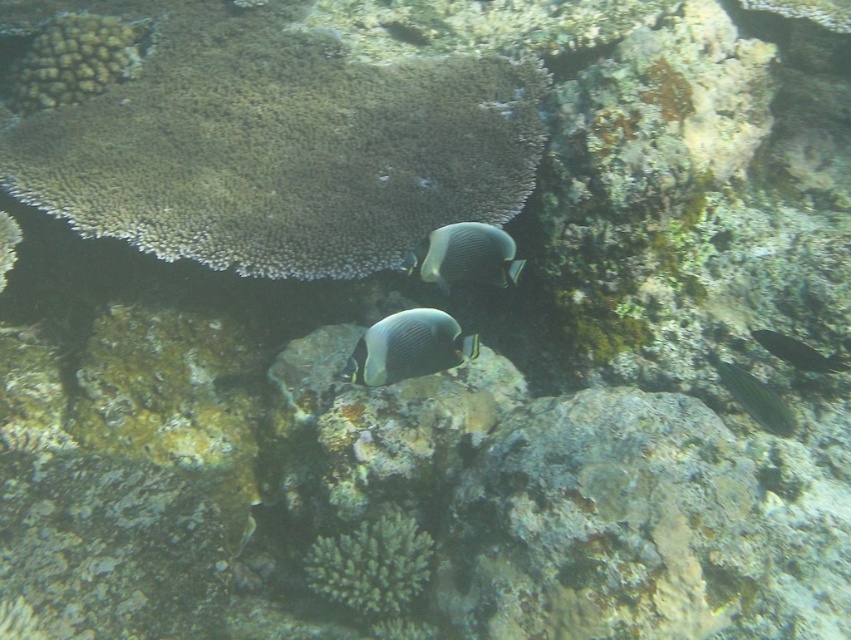
Question: Does silvery iridescent fish at center appear on the right side of silvery metallic fish at lower right?

Choices:
 (A) no
 (B) yes

Answer: (A)

Question: Among these points, which one is nearest to the camera?

Choices:
 (A) (426, 340)
 (B) (227, 141)
 (C) (810, 356)

Answer: (A)

Question: Which of the following is the closest to the observer?

Choices:
 (A) silvery metallic fish at lower right
 (B) silvery iridescent fish at center
 (C) shiny green fish at lower right

Answer: (B)

Question: Estimate the real-world distances between objects in this image. Which object is closer to the silvery metallic fish at lower right?

Choices:
 (A) shiny green fish at lower right
 (B) white porous coral at upper left

Answer: (A)

Question: Is white porous coral at upper left thinner than silvery iridescent fish at center?

Choices:
 (A) yes
 (B) no

Answer: (B)

Question: Is white porous coral at upper left thinner than silvery iridescent fish at center?

Choices:
 (A) no
 (B) yes

Answer: (A)